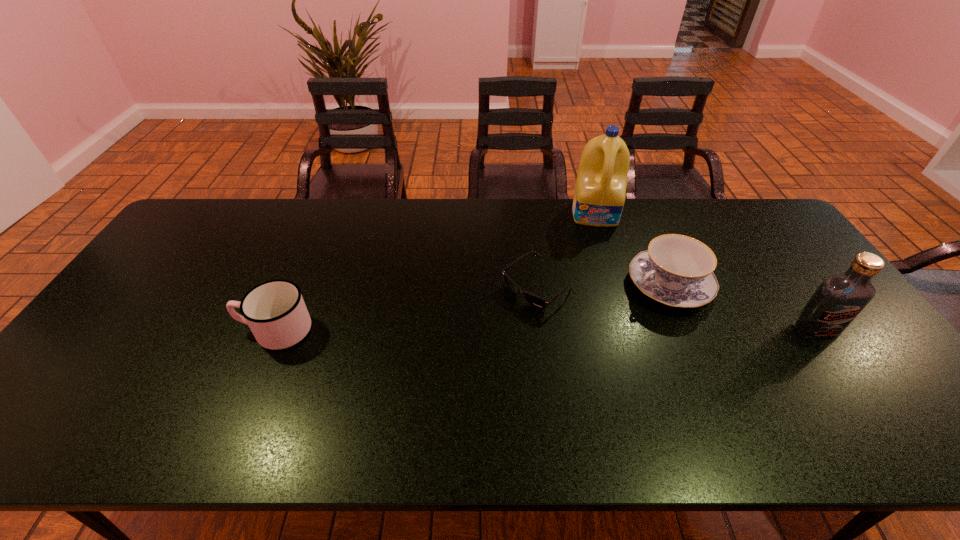
Locate an element on the screen. Image resolution: width=960 pixels, height=540 pixels. mug is located at coordinates (275, 311).

I want to click on the rightmost object, so click(838, 300).

Where is `the second tallest object`? The height and width of the screenshot is (540, 960). the second tallest object is located at coordinates pyautogui.click(x=838, y=300).

Find the location of a particular element. This screenshot has height=540, width=960. chinaware is located at coordinates (676, 270).

Where is `detergent`? Image resolution: width=960 pixels, height=540 pixels. detergent is located at coordinates (599, 197).

In order to click on the farthest object in this screenshot , I will do `click(599, 197)`.

Identify the location of the fourth object from right to left. (540, 303).

At what (x,y) coordinates should I click in order to perform the action: click on the shortest object. Please return your answer as a coordinate pair (x, y). This screenshot has width=960, height=540. Looking at the image, I should click on (540, 303).

Locate an element on the screen. The height and width of the screenshot is (540, 960). free space located on the side of the mug with the handle is located at coordinates (147, 330).

In order to click on free location located on the side of the mug with the handle in this screenshot , I will do `click(124, 330)`.